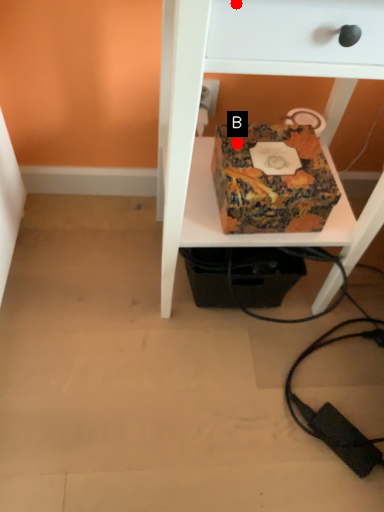
Question: Two points are circled on the image, labeled by A and B beside each circle. Among these points, which one is farthest from the camera?

Choices:
 (A) A is further
 (B) B is further

Answer: (B)